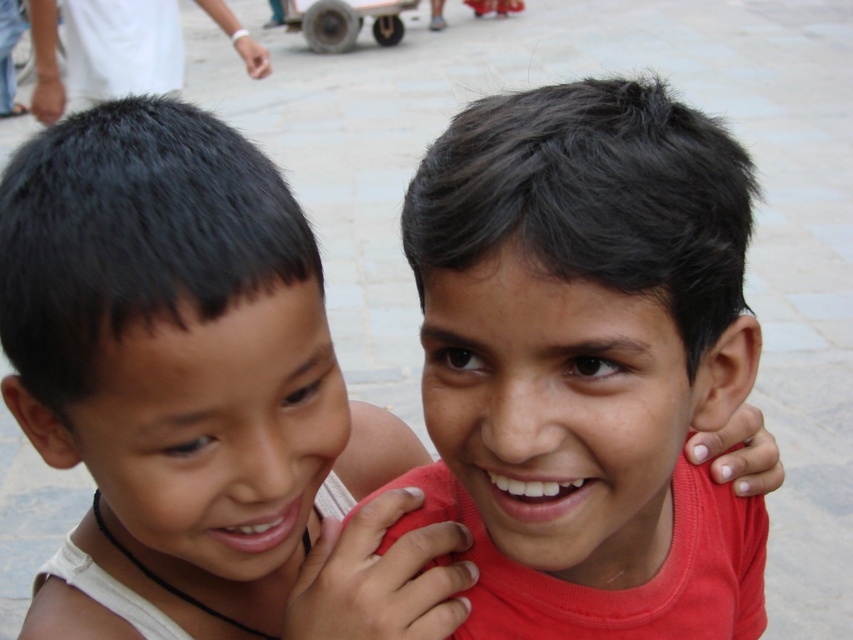
Which is more to the left, smooth skin boy at left or dark hair at upper left?

Positioned to the left is dark hair at upper left.

Is point (225, 512) closer to camera compared to point (50, 19)?

Yes.

Find the location of a particular element. smooth skin boy at left is located at coordinates (180, 346).

Is matte red shirt at center thinner than dark hair at upper left?

Yes, matte red shirt at center is thinner than dark hair at upper left.

Is matte red shirt at center shorter than dark hair at upper left?

Indeed, matte red shirt at center has a lesser height compared to dark hair at upper left.

Who is more forward, (550, 356) or (109, 4)?

Positioned in front is point (550, 356).

At what (x,y) coordinates should I click in order to perform the action: click on matte red shirt at center. Please return your answer as a coordinate pair (x, y). Image resolution: width=853 pixels, height=640 pixels. Looking at the image, I should click on (585, 362).

Locate an element on the screen. The width and height of the screenshot is (853, 640). matte red shirt at center is located at coordinates (585, 362).

Locate an element on the screen. The image size is (853, 640). matte red shirt at center is located at coordinates (585, 362).

You are a GUI agent. You are given a task and a screenshot of the screen. Output one action in this format:
    pyautogui.click(x=<x>, y=<y>)
    Task: Click on the matte red shirt at center
    
    Given the screenshot: What is the action you would take?
    pyautogui.click(x=585, y=362)